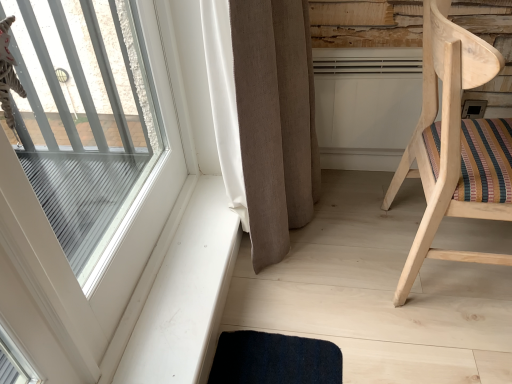
Where is `free space above white smooth window sill at lower left (from a real-world perspective)`? free space above white smooth window sill at lower left (from a real-world perspective) is located at coordinates point(180,261).